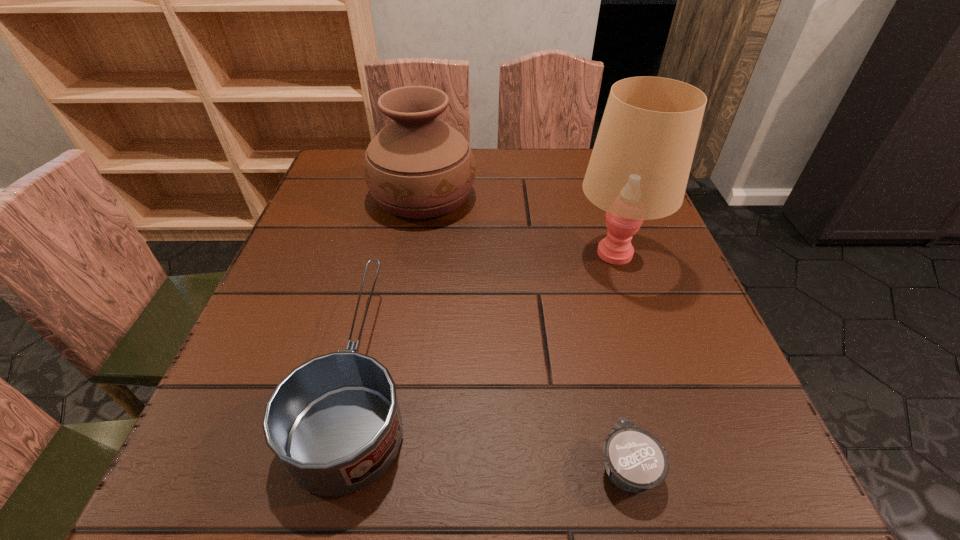
At what (x,y) coordinates should I click in order to perform the action: click on object that is at the far edge. Please return your answer as a coordinate pair (x, y). This screenshot has height=540, width=960. Looking at the image, I should click on (419, 167).

You are a GUI agent. You are given a task and a screenshot of the screen. Output one action in this format:
    pyautogui.click(x=<x>, y=<y>)
    Task: Click on the saucepan that is at the near edge
    This screenshot has height=540, width=960.
    Given the screenshot: What is the action you would take?
    pyautogui.click(x=334, y=422)

Image resolution: width=960 pixels, height=540 pixels. In order to click on yogurt that is at the near edge in this screenshot , I will do `click(635, 460)`.

Where is `urn that is at the left edge`? Image resolution: width=960 pixels, height=540 pixels. urn that is at the left edge is located at coordinates (419, 167).

Identify the location of saucepan positioned at the left edge. The width and height of the screenshot is (960, 540). (334, 422).

Find the location of `lampshade at the right edge`. lampshade at the right edge is located at coordinates pyautogui.click(x=640, y=164).

Find the location of `yogurt that is at the right edge`. yogurt that is at the right edge is located at coordinates (635, 460).

Locate an element on the screen. This screenshot has height=540, width=960. object at the far left corner is located at coordinates (419, 167).

This screenshot has width=960, height=540. Identify the location of object positioned at the near left corner. (334, 422).

Where is `object that is at the near right corner`? The width and height of the screenshot is (960, 540). object that is at the near right corner is located at coordinates (635, 460).